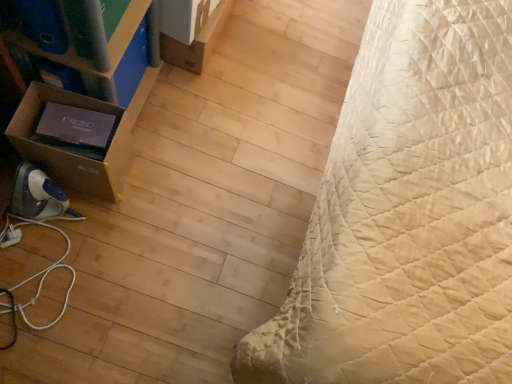
The width and height of the screenshot is (512, 384). I want to click on vacant area that lies to the right of matte cardboard box at left, so coord(190,135).